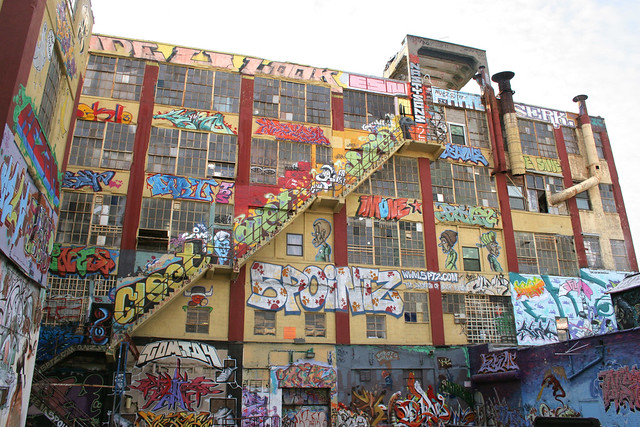
Identify the location of the 4th row of stairs. The width and height of the screenshot is (640, 427). (274, 230).